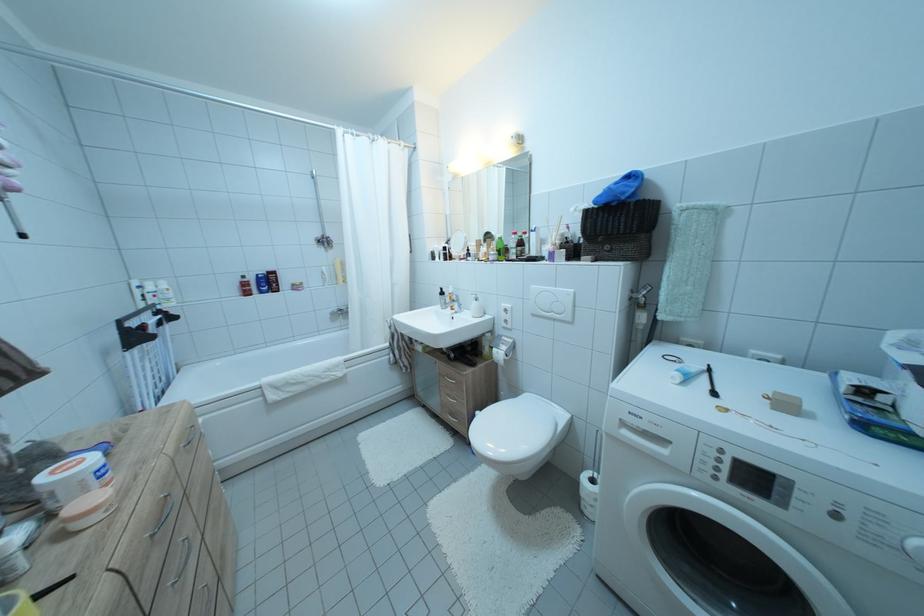
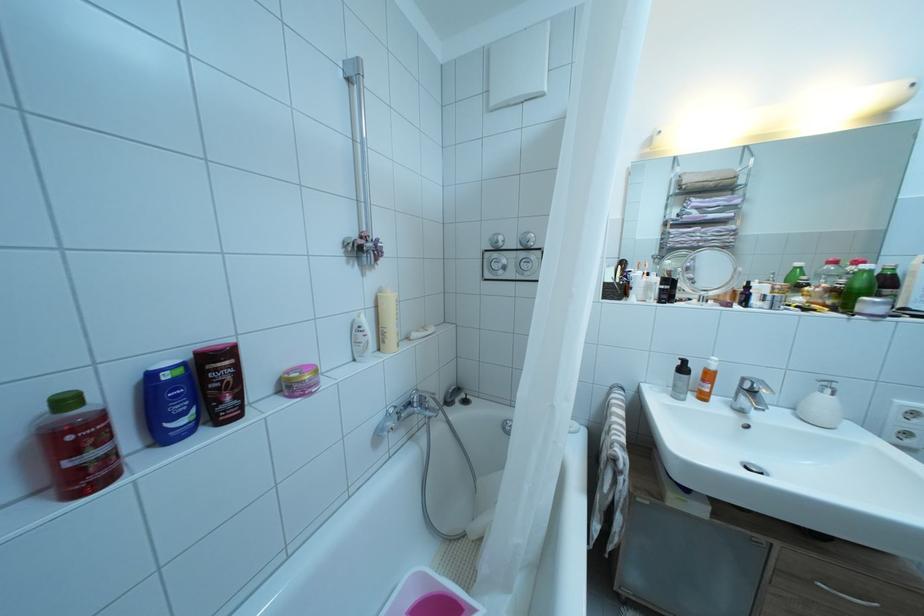
Which direction would the cameraman need to move to produce the second image?

The cameraman moved toward left, forward.